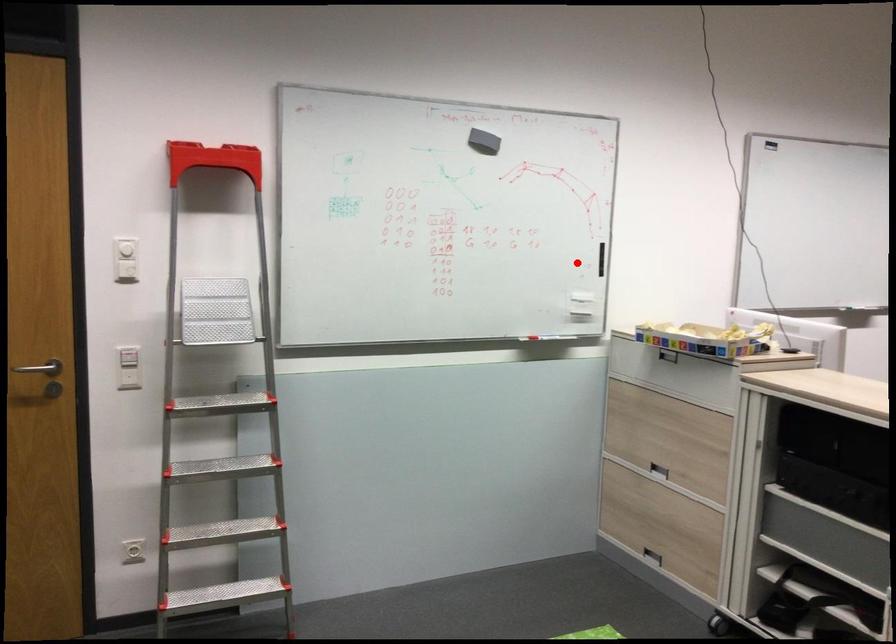
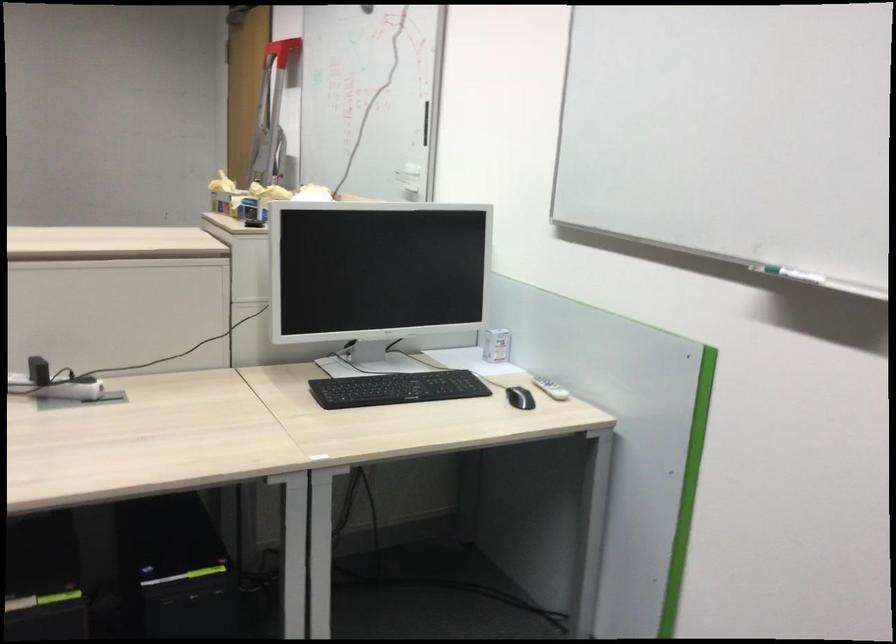
Question: I am providing you with two images of the same scene from different viewpoints. In image1, a red point is highlighted. Considering the same 3D point in image2, which of the following is correct?

Choices:
 (A) It is closer
 (B) It is farther

Answer: (A)